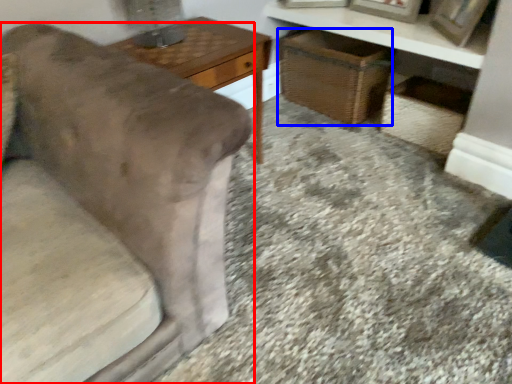
Question: Which point is closer to the camera, furniture (highlighted by a red box) or basket (highlighted by a blue box)?

Choices:
 (A) furniture
 (B) basket

Answer: (A)